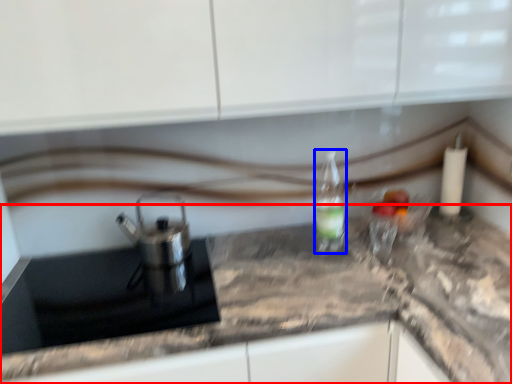
Question: Which point is closer to the camera, countertop (highlighted by a red box) or bottle (highlighted by a blue box)?

Choices:
 (A) countertop
 (B) bottle

Answer: (A)